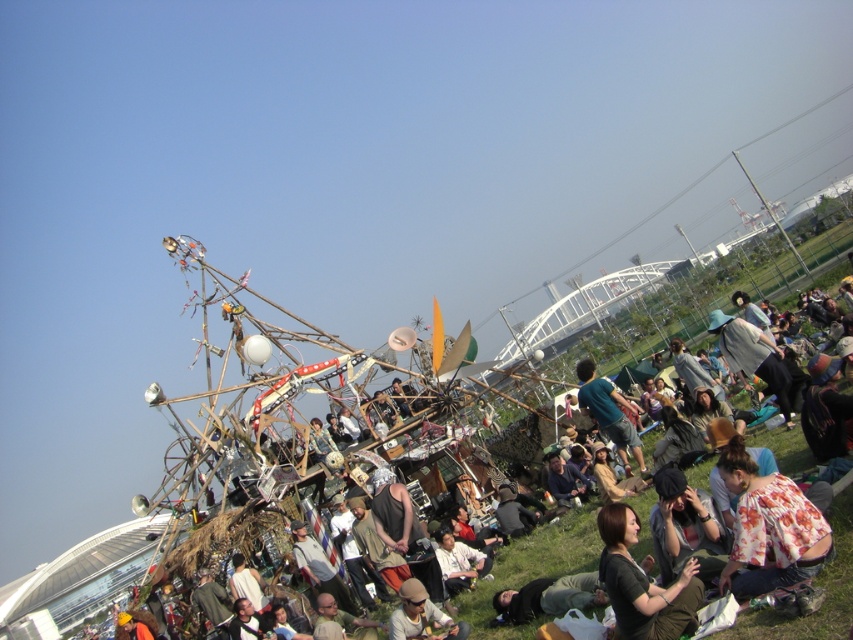
Question: Does floral print blouse at lower right have a lesser width compared to green fabric shirt at center?

Choices:
 (A) yes
 (B) no

Answer: (A)

Question: Which point is closer to the camera?

Choices:
 (A) (843, 637)
 (B) (630, 573)
 (C) (811, 568)

Answer: (A)

Question: Is floral print blouse at lower right to the left of green fabric shirt at center from the viewer's perspective?

Choices:
 (A) yes
 (B) no

Answer: (B)

Question: Where is floral print blouse at lower right located in relation to black fabric shirt at lower right in the image?

Choices:
 (A) left
 (B) right

Answer: (B)

Question: Which object is closer to the camera taking this photo?

Choices:
 (A) floral print blouse at lower right
 (B) black fabric shirt at lower right
 (C) green fabric shirt at center
 (D) wooden sculpture at center

Answer: (D)

Question: Which point appears farthest from the camera in this image?

Choices:
 (A) (616, 552)
 (B) (570, 534)

Answer: (B)